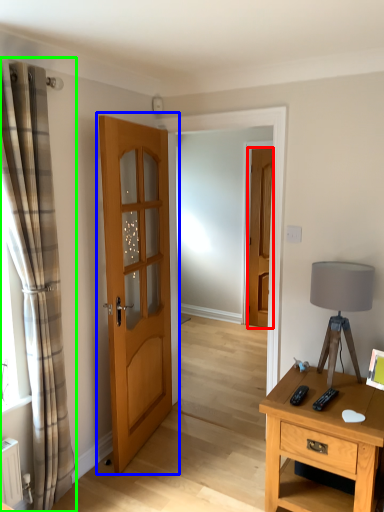
Question: Based on their relative distances, which object is farther from door (highlighted by a red box)? Choose from door (highlighted by a blue box) and curtain (highlighted by a green box).

Choices:
 (A) door
 (B) curtain

Answer: (B)